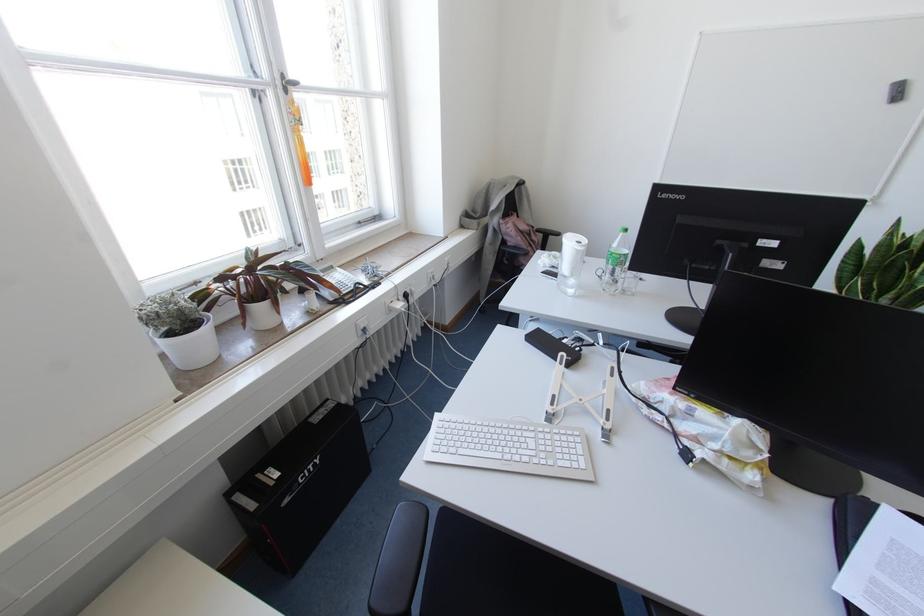
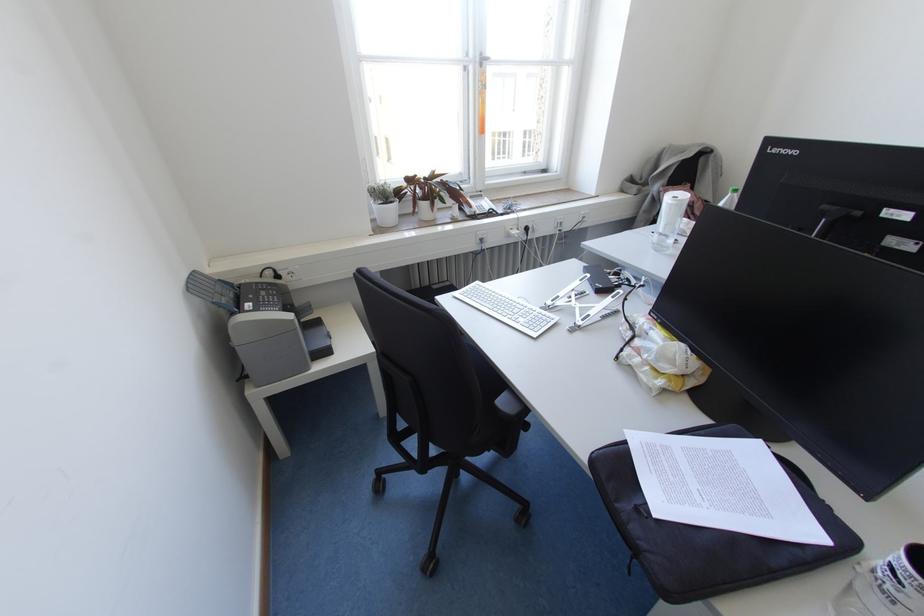
In the second image, find the point that corresponds to pixel 357 285 in the first image.

(490, 209)